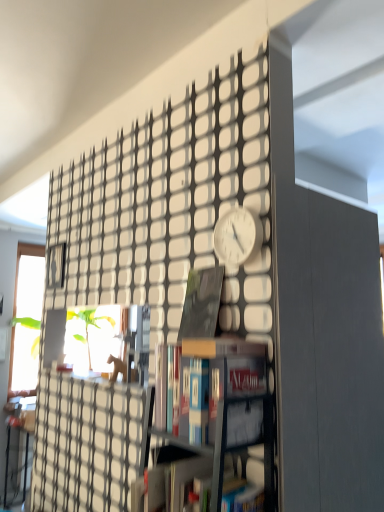
Question: From the image's perspective, would you say hardcover book at center, marked as the second book in a bottom-to-top arrangement, is shown under matte black book at center, marked as the 1th book in a top-to-bottom arrangement?

Choices:
 (A) yes
 (B) no

Answer: (A)

Question: Does hardcover book at center, the 2th book positioned from the top, have a greater height compared to matte black book at center, the 3th book in the bottom-to-top sequence?

Choices:
 (A) yes
 (B) no

Answer: (B)

Question: Is the surface of hardcover book at center, the 2th book positioned from the top, in direct contact with matte black book at center, marked as the 1th book in a top-to-bottom arrangement?

Choices:
 (A) yes
 (B) no

Answer: (B)

Question: Is hardcover book at center, the 2th book positioned from the top, in front of matte black book at center, marked as the 1th book in a top-to-bottom arrangement?

Choices:
 (A) no
 (B) yes

Answer: (B)

Question: From the image's perspective, does hardcover book at center, the 2th book positioned from the top, appear higher than matte black book at center, the 3th book in the bottom-to-top sequence?

Choices:
 (A) no
 (B) yes

Answer: (A)

Question: Is hardcover book at center, the 2th book positioned from the top, not within matte black book at center, marked as the 1th book in a top-to-bottom arrangement?

Choices:
 (A) no
 (B) yes

Answer: (B)

Question: Is white matte clock at center positioned with its back to matte black book at center, marked as the 1th book in a top-to-bottom arrangement?

Choices:
 (A) no
 (B) yes

Answer: (A)

Question: Would you say matte black book at center, marked as the 1th book in a top-to-bottom arrangement, is part of white matte clock at center's contents?

Choices:
 (A) yes
 (B) no

Answer: (B)

Question: Considering the relative sizes of white matte clock at center and matte black book at center, the 3th book in the bottom-to-top sequence, in the image provided, is white matte clock at center shorter than matte black book at center, the 3th book in the bottom-to-top sequence,?

Choices:
 (A) yes
 (B) no

Answer: (A)

Question: From a real-world perspective, is white matte clock at center physically above matte black book at center, marked as the 1th book in a top-to-bottom arrangement?

Choices:
 (A) yes
 (B) no

Answer: (A)

Question: Is white matte clock at center thinner than matte black book at center, the 3th book in the bottom-to-top sequence?

Choices:
 (A) yes
 (B) no

Answer: (B)

Question: Does white matte clock at center have a smaller size compared to matte black book at center, marked as the 1th book in a top-to-bottom arrangement?

Choices:
 (A) yes
 (B) no

Answer: (B)

Question: From the image's perspective, is hardcover book at center, which ranks as the 1th book in bottom-to-top order, located above hardcover book at center, the 2th book positioned from the top?

Choices:
 (A) yes
 (B) no

Answer: (B)